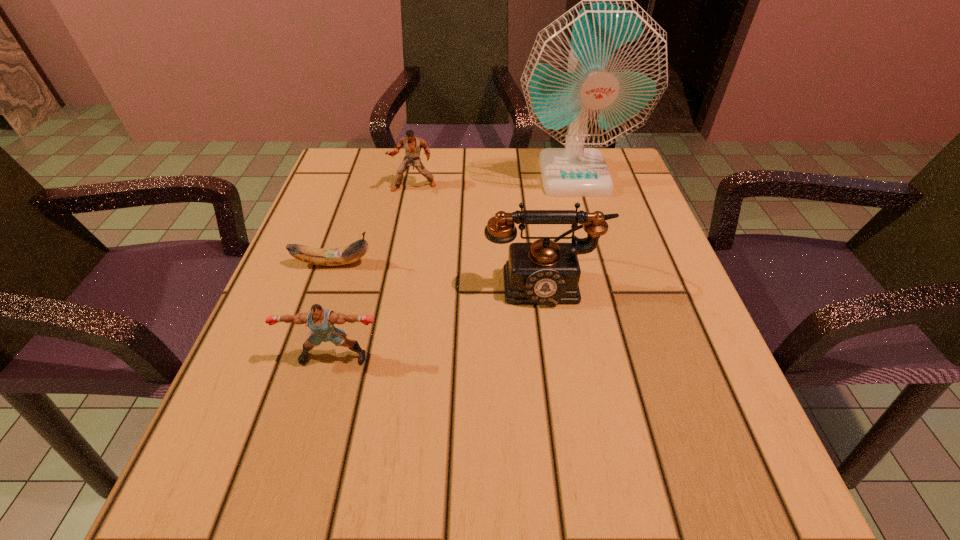
In the image, there is a desktop. Where is `free space at the left edge`? free space at the left edge is located at coordinates [292, 305].

I want to click on vacant area at the right edge, so click(x=638, y=299).

In the image, there is a desktop. In order to click on vacant space at the far left corner in this screenshot , I will do pyautogui.click(x=363, y=170).

The height and width of the screenshot is (540, 960). I want to click on vacant space at the near left corner of the desktop, so click(x=228, y=498).

The image size is (960, 540). I want to click on free region at the far right corner of the desktop, so click(x=615, y=171).

Locate an element on the screen. The image size is (960, 540). free area in between the fourth shortest object and the farther puncher is located at coordinates (479, 233).

The image size is (960, 540). In order to click on blank region between the second shortest object and the banana in this screenshot , I will do `click(334, 310)`.

Identify the location of unoccupied position between the farther puncher and the banana. (373, 225).

Locate an element on the screen. This screenshot has height=540, width=960. free space between the fan and the nearest object is located at coordinates (454, 266).

Locate an element on the screen. The height and width of the screenshot is (540, 960). free spot between the banana and the farther puncher is located at coordinates (373, 225).